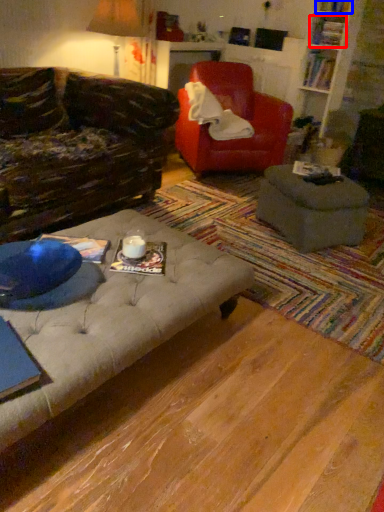
Question: Which of the following is the closest to the observer, book (highlighted by a red box) or book (highlighted by a blue box)?

Choices:
 (A) book
 (B) book

Answer: (B)